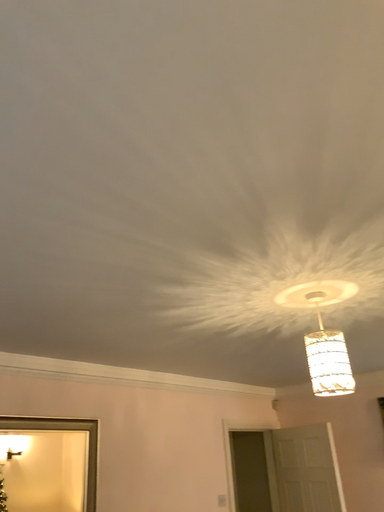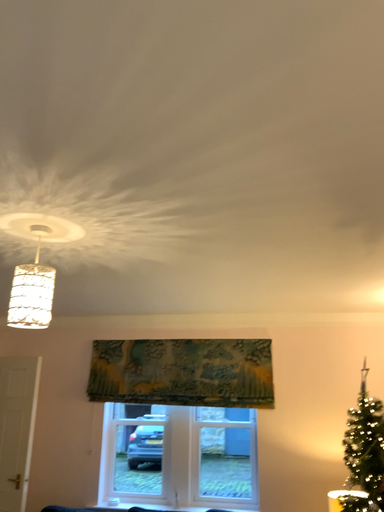
Question: Which way did the camera rotate in the video?

Choices:
 (A) rotated left
 (B) rotated right

Answer: (B)